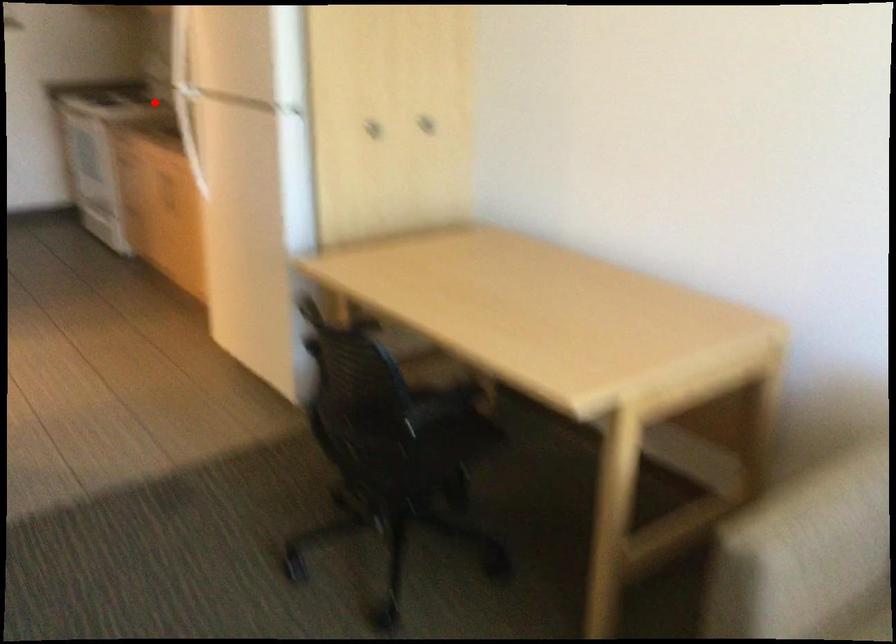
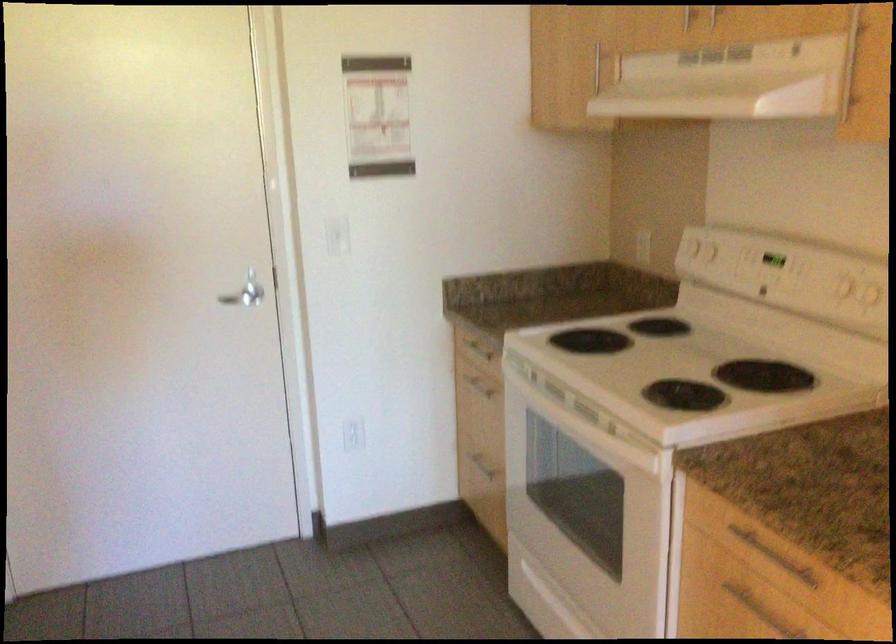
The point at the highlighted location is marked in the first image. Where is the corresponding point in the second image?

(686, 365)